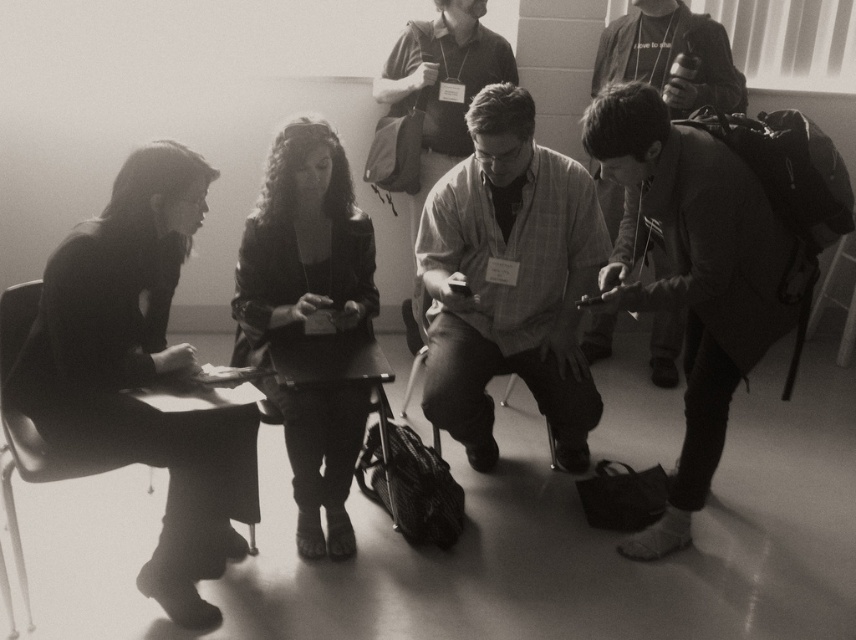
Is denim jacket at center to the left of metallic black chair at left from the viewer's perspective?

Incorrect, denim jacket at center is not on the left side of metallic black chair at left.

I want to click on denim jacket at center, so click(x=432, y=97).

The image size is (856, 640). I want to click on denim jacket at center, so click(432, 97).

The image size is (856, 640). What do you see at coordinates (691, 275) in the screenshot?
I see `coarse fabric jacket at right` at bounding box center [691, 275].

Looking at this image, who is higher up, coarse fabric jacket at right or metallic gray chair at center?

coarse fabric jacket at right is above.

This screenshot has width=856, height=640. What do you see at coordinates (691, 275) in the screenshot?
I see `coarse fabric jacket at right` at bounding box center [691, 275].

At what (x,y) coordinates should I click in order to perform the action: click on coarse fabric jacket at right. Please return your answer as a coordinate pair (x, y). Image resolution: width=856 pixels, height=640 pixels. Looking at the image, I should click on (691, 275).

Who is lower down, smooth black dress at left or metallic gray chair at center?

smooth black dress at left is below.

Is point (174, 513) farther from camera compared to point (551, 452)?

No.

The width and height of the screenshot is (856, 640). What are the coordinates of `smooth black dress at left` in the screenshot? It's located at (140, 371).